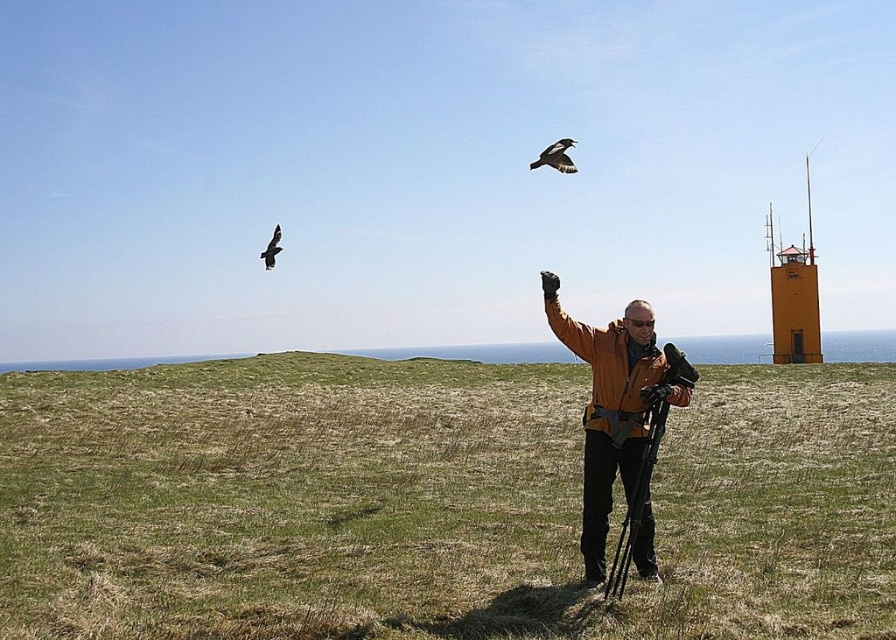
Does orange softshell jacket at center have a greater height compared to black plastic tripod at center?

Yes, orange softshell jacket at center is taller than black plastic tripod at center.

Is the position of orange softshell jacket at center more distant than that of black plastic tripod at center?

Yes, orange softshell jacket at center is further from the viewer.

Does point (614, 364) lie behind point (668, 394)?

Yes, it is behind point (668, 394).

You are a GUI agent. You are given a task and a screenshot of the screen. Output one action in this format:
    pyautogui.click(x=<x>, y=<y>)
    Task: Click on the orange softshell jacket at center
    The width and height of the screenshot is (896, 640).
    Given the screenshot: What is the action you would take?
    pyautogui.click(x=618, y=419)

Does orange softshell jacket at center appear on the left side of dark brown feathers at upper left?

In fact, orange softshell jacket at center is to the right of dark brown feathers at upper left.

Consider the image. Who is higher up, orange softshell jacket at center or dark brown feathers at upper left?

dark brown feathers at upper left is higher up.

Is point (601, 356) behind point (277, 225)?

No, it is in front of (277, 225).

You are a GUI agent. You are given a task and a screenshot of the screen. Output one action in this format:
    pyautogui.click(x=<x>, y=<y>)
    Task: Click on the orange softshell jacket at center
    The image size is (896, 640).
    Given the screenshot: What is the action you would take?
    pyautogui.click(x=618, y=419)

Between yellow painted metal tower at right and black glossy bird at upper center, which one appears on the left side from the viewer's perspective?

Positioned to the left is black glossy bird at upper center.

Is yellow painted metal tower at right closer to camera compared to black glossy bird at upper center?

No, it is behind black glossy bird at upper center.

At what (x,y) coordinates should I click in order to perform the action: click on yellow painted metal tower at right. Please return your answer as a coordinate pair (x, y). This screenshot has width=896, height=640. Looking at the image, I should click on (794, 296).